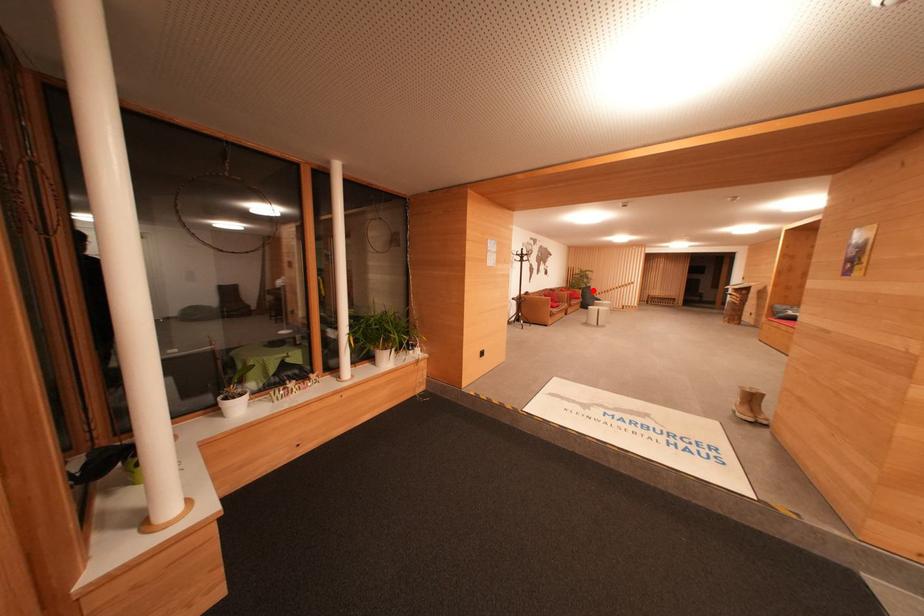
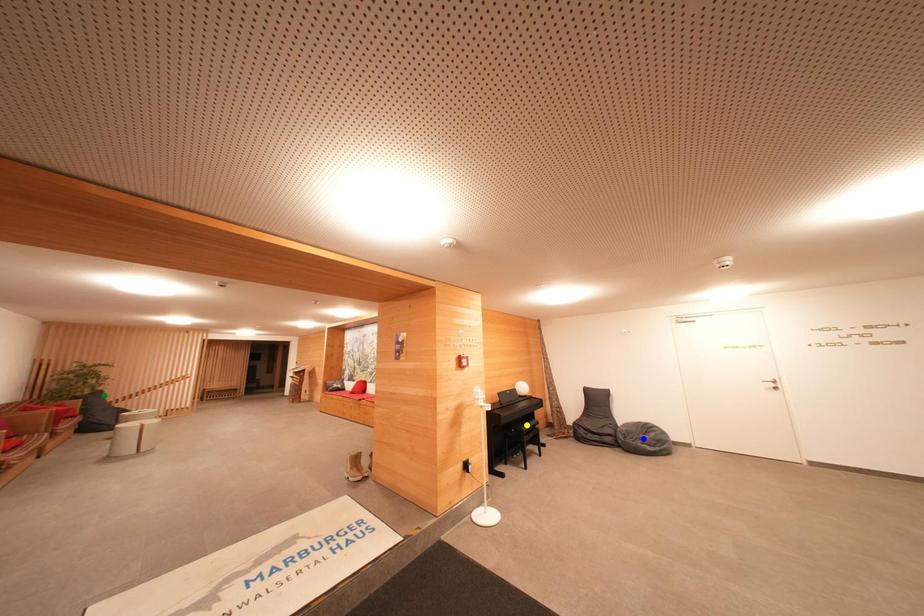
Question: I am providing you with two images of the same scene from different viewpoints. A red point is marked on the first image. You are given multiple points on the second image. Which point in image 2 represents the same 3d spot as the red point in image 1?

Choices:
 (A) green point
 (B) yellow point
 (C) blue point

Answer: (A)